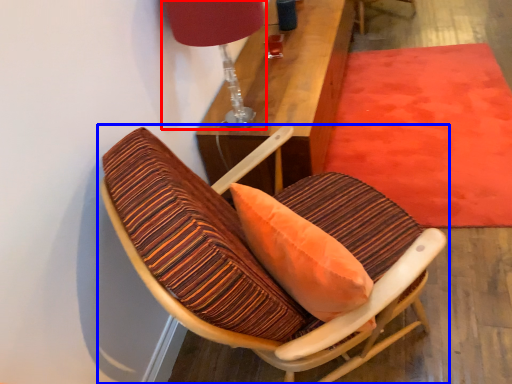
Question: Which object is closer to the camera taking this photo, table lamp (highlighted by a red box) or chair (highlighted by a blue box)?

Choices:
 (A) table lamp
 (B) chair

Answer: (B)